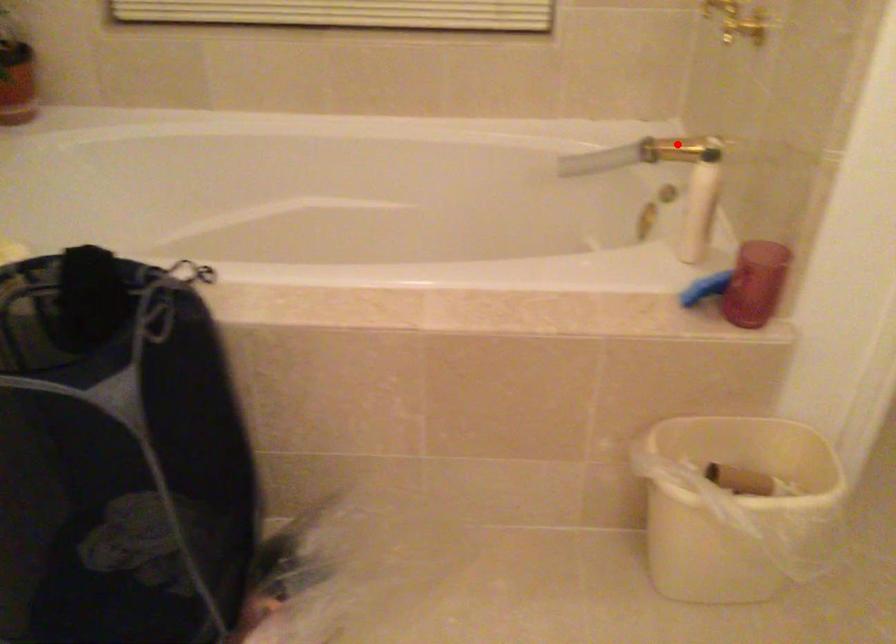
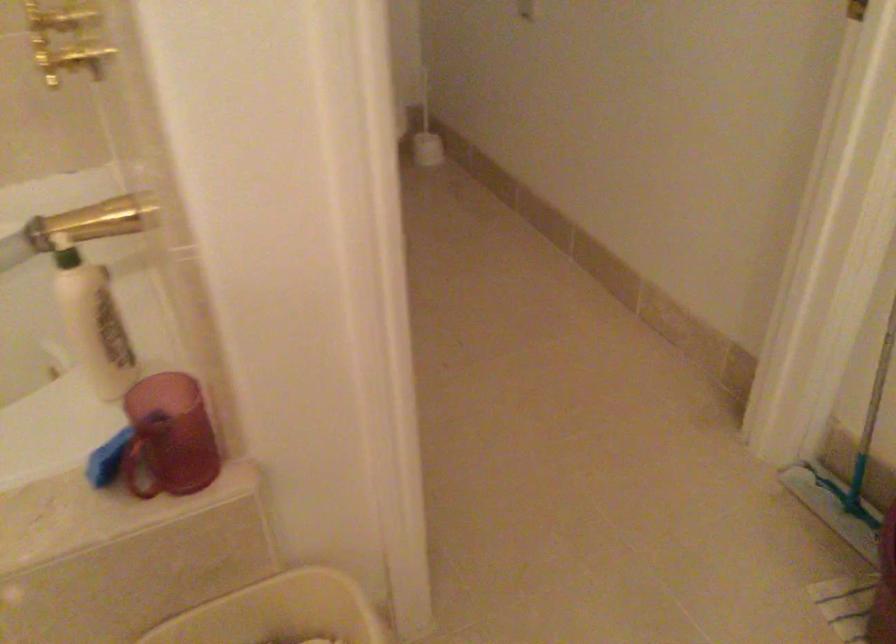
Question: I am providing you with two images of the same scene from different viewpoints. Given a red point in image1, look at the same physical point in image2. Is it:

Choices:
 (A) Closer to the viewpoint
 (B) Farther from the viewpoint

Answer: (A)